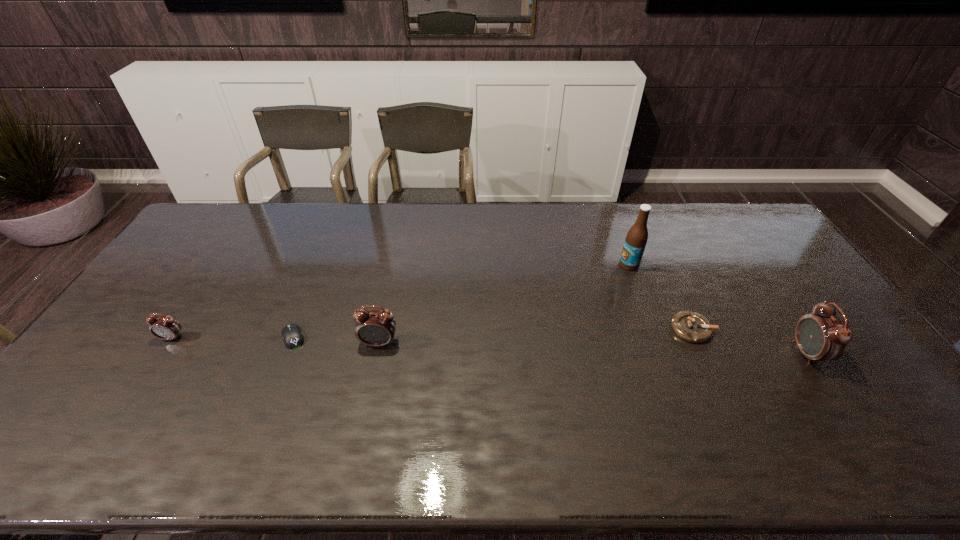
Image resolution: width=960 pixels, height=540 pixels. What are the coordinates of `free point between the second object from right to left and the second shortest alarm clock` in the screenshot? It's located at (536, 336).

At what (x,y) coordinates should I click in order to perform the action: click on free space between the beer bottle and the second object from right to left. Please return your answer as a coordinate pair (x, y). This screenshot has width=960, height=540. Looking at the image, I should click on (660, 297).

In order to click on vacant area that lies between the third shortest object and the fourth shortest object in this screenshot , I will do `click(276, 340)`.

The width and height of the screenshot is (960, 540). Find the location of `object identified as the second closest to the leftmost object`. object identified as the second closest to the leftmost object is located at coordinates [375, 328].

Identify which object is the second closest to the computer equipment. Please provide its 2D coordinates. Your answer should be formatted as a tuple, i.e. [(x, y)], where the tuple contains the x and y coordinates of a point satisfying the conditions above.

[(164, 327)]

I want to click on alarm clock that is the closest one to the computer equipment, so (375, 328).

Locate an element on the screen. The width and height of the screenshot is (960, 540). alarm clock that is the closest to the rightmost object is located at coordinates (375, 328).